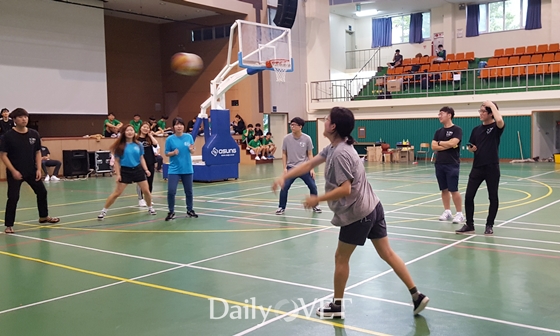
The height and width of the screenshot is (336, 560). I want to click on yellow bucket, so click(x=556, y=157).